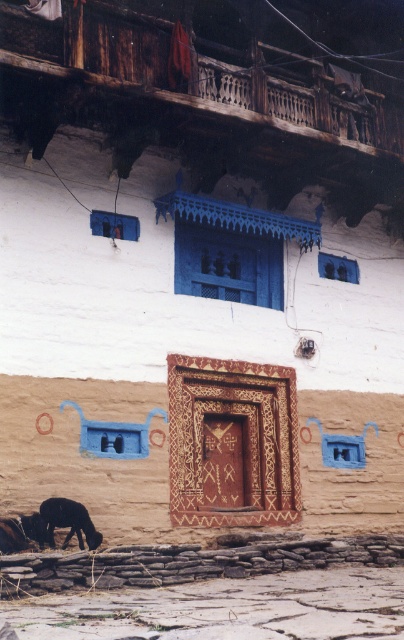
Question: Which point is farther to the camera?

Choices:
 (A) (121, 61)
 (B) (56, 520)
 (C) (0, 532)

Answer: (A)

Question: Is wooden balcony at upper center behind black fur dog at lower left?

Choices:
 (A) no
 (B) yes

Answer: (B)

Question: Is wooden balcony at upper center wider than black fur goat at lower left?

Choices:
 (A) yes
 (B) no

Answer: (A)

Question: Is wooden balcony at upper center positioned at the back of black fur goat at lower left?

Choices:
 (A) yes
 (B) no

Answer: (A)

Question: Among these objects, which one is nearest to the camera?

Choices:
 (A) black fur goat at lower left
 (B) wooden balcony at upper center
 (C) black fur dog at lower left

Answer: (C)

Question: Estimate the real-world distances between objects in this image. Which object is farther from the black fur goat at lower left?

Choices:
 (A) wooden balcony at upper center
 (B) black fur dog at lower left

Answer: (A)